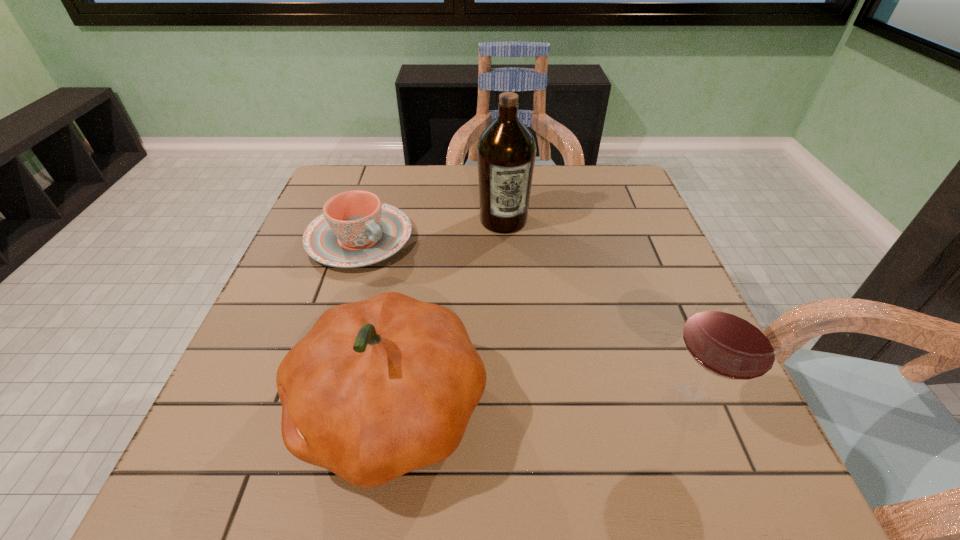
At what (x,y) coordinates should I click in order to perform the action: click on free space on the desktop that is between the pumpkin and the wineglass and is positioned on the handle side of the shortest object. Please return your answer as a coordinate pair (x, y). Image resolution: width=960 pixels, height=540 pixels. Looking at the image, I should click on (573, 408).

I want to click on free space on the desktop that is between the pumpkin and the rightmost object and is positioned on the label of the olive oil, so click(x=560, y=408).